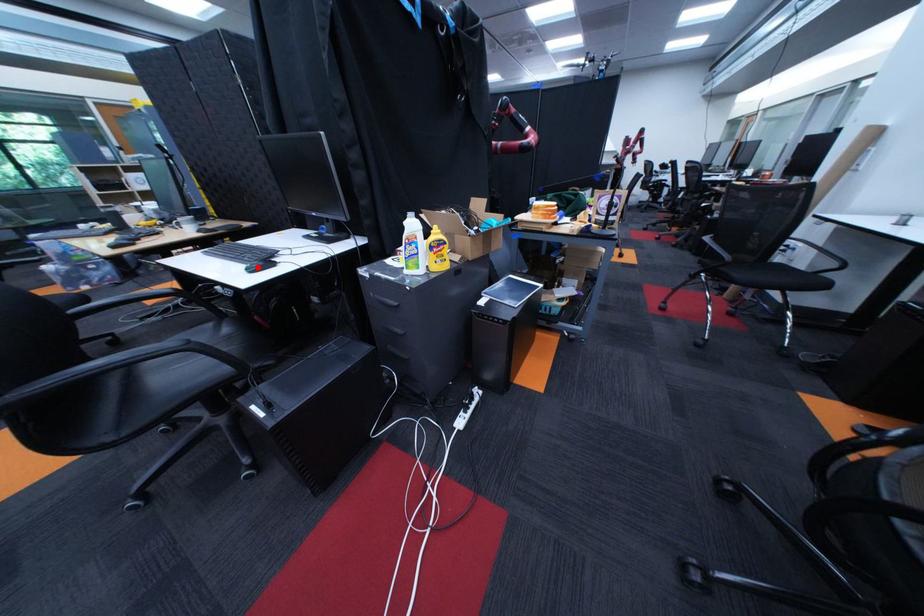
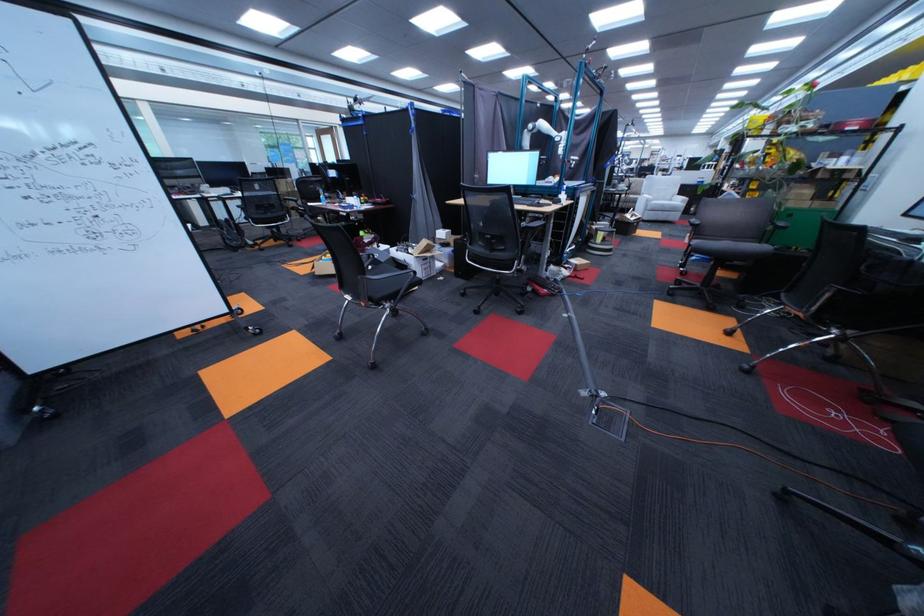
Question: I am providing you with two images of the same scene from different viewpoints. A red point is marked on the first image. At the location where the point appears in image 1, is it still visible in image 2?

Choices:
 (A) Yes
 (B) No

Answer: (B)